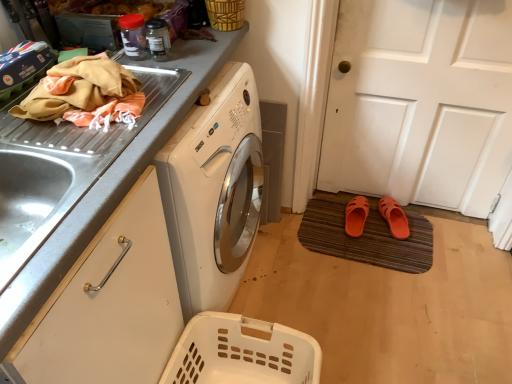
I want to click on free location to the left of orange rubber sandals at lower right, positioned as the 1th footwear in right-to-left order, so click(x=348, y=227).